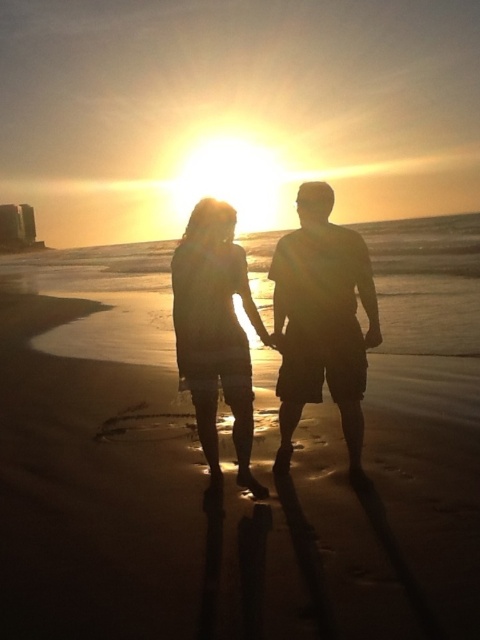
Can you confirm if sandy beach at center is positioned to the right of silhouette shorts at center?

Indeed, sandy beach at center is positioned on the right side of silhouette shorts at center.

Who is taller, sandy beach at center or silhouette shorts at center?

With more height is sandy beach at center.

Who is more distant from viewer, (40, 508) or (354, 461)?

The point (354, 461) is more distant.

Identify the location of sandy beach at center. coord(232,461).

Can you confirm if silhouette shorts at center is positioned below silhouette dress at center?

No.

Is silhouette shorts at center thinner than silhouette dress at center?

No, silhouette shorts at center is not thinner than silhouette dress at center.

Is point (357, 385) positioned after point (192, 317)?

That is True.

This screenshot has width=480, height=640. I want to click on silhouette shorts at center, so click(x=322, y=321).

Between point (326, 483) and point (201, 211), which one is positioned behind?

Positioned behind is point (326, 483).

Where is `sandy beach at center`? sandy beach at center is located at coordinates (232, 461).